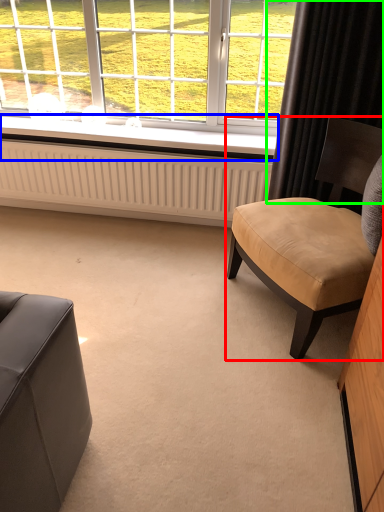
Question: Based on their relative distances, which object is farther from chair (highlighted by a red box)? Choose from window sill (highlighted by a blue box) and curtain (highlighted by a green box).

Choices:
 (A) window sill
 (B) curtain

Answer: (A)